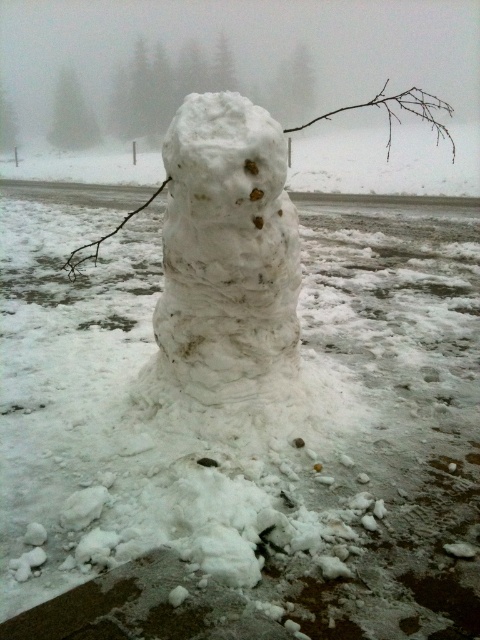
You are standing in a snowy area and want to take a photo of the white fluffy snowman at center. If your camera has a maximum focus range of 7 feet, will you be able to capture the snowman clearly?

The white fluffy snowman at center is 7.57 feet away from the viewer. Since the camera can only focus up to 7 feet, it won not be able to capture the snowman clearly.

You are standing at the center of the image. A white fluffy snowman at center is in front of you. If you walk straight ahead, will you walk towards the snowman?

The white fluffy snowman at center is located at point (227, 256), which is near the center of the image. Since you are also at the center, walking straight ahead would take you directly towards the snowman.